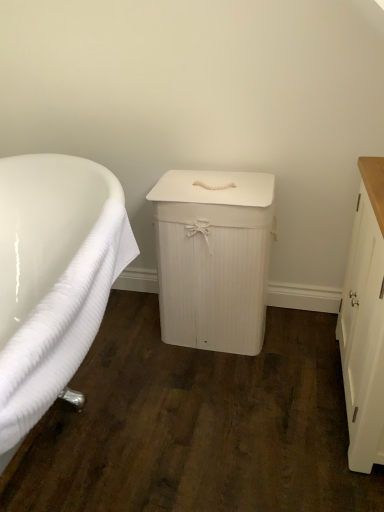
Question: Which direction should I rotate to face white wood laundry bin at center, which is the 2th cabinetry from right to left, — up or down?

Choices:
 (A) up
 (B) down

Answer: (B)

Question: From the image's perspective, does white wood laundry bin at center, which is the 2th cabinetry from right to left, appear higher than white wood cabinet at right, which is the first cabinetry in right-to-left order?

Choices:
 (A) no
 (B) yes

Answer: (B)

Question: Is white wood laundry bin at center, which is the 2th cabinetry from right to left, smaller than white wood cabinet at right, which is the first cabinetry in right-to-left order?

Choices:
 (A) yes
 (B) no

Answer: (B)

Question: Are white wood laundry bin at center, which is the 2th cabinetry from right to left, and white wood cabinet at right, marked as the 2th cabinetry in a left-to-right arrangement, located far from each other?

Choices:
 (A) yes
 (B) no

Answer: (B)

Question: Is white wood laundry bin at center, which is the 2th cabinetry from right to left, further to camera compared to white wood cabinet at right, which is the first cabinetry in right-to-left order?

Choices:
 (A) yes
 (B) no

Answer: (A)

Question: Considering the relative positions of white wood laundry bin at center, which ranks as the 1th cabinetry in left-to-right order, and white wood cabinet at right, which is the first cabinetry in right-to-left order, in the image provided, is white wood laundry bin at center, which ranks as the 1th cabinetry in left-to-right order, to the left of white wood cabinet at right, which is the first cabinetry in right-to-left order, from the viewer's perspective?

Choices:
 (A) no
 (B) yes

Answer: (B)

Question: Is white wood laundry bin at center, which is the 2th cabinetry from right to left, positioned in front of white wood cabinet at right, which is the first cabinetry in right-to-left order?

Choices:
 (A) yes
 (B) no

Answer: (B)

Question: Is white ribbed towel at left looking in the opposite direction of white wood laundry bin at center, which is the 2th cabinetry from right to left?

Choices:
 (A) yes
 (B) no

Answer: (B)

Question: Is the position of white ribbed towel at left less distant than that of white wood laundry bin at center, which ranks as the 1th cabinetry in left-to-right order?

Choices:
 (A) yes
 (B) no

Answer: (A)

Question: Does white ribbed towel at left appear on the left side of white wood laundry bin at center, which is the 2th cabinetry from right to left?

Choices:
 (A) no
 (B) yes

Answer: (B)

Question: From a real-world perspective, is white ribbed towel at left on white wood laundry bin at center, which ranks as the 1th cabinetry in left-to-right order?

Choices:
 (A) no
 (B) yes

Answer: (B)

Question: From a real-world perspective, is white ribbed towel at left positioned under white wood laundry bin at center, which is the 2th cabinetry from right to left, based on gravity?

Choices:
 (A) no
 (B) yes

Answer: (A)

Question: Is white ribbed towel at left outside of white wood laundry bin at center, which is the 2th cabinetry from right to left?

Choices:
 (A) no
 (B) yes

Answer: (B)

Question: From a real-world perspective, is white wood laundry bin at center, which is the 2th cabinetry from right to left, below white ribbed towel at left?

Choices:
 (A) no
 (B) yes

Answer: (B)